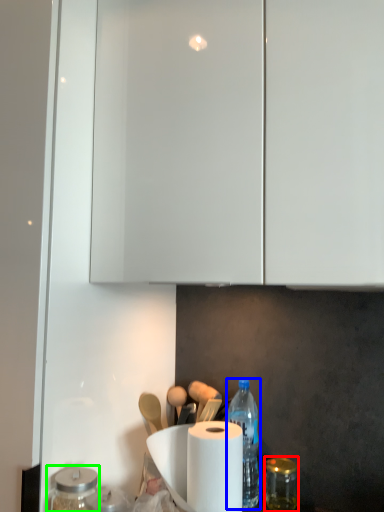
Question: Based on their relative distances, which object is nearer to glass jar (highlighted by a red box)? Choose from bottle (highlighted by a blue box) and glass jar (highlighted by a green box).

Choices:
 (A) bottle
 (B) glass jar

Answer: (A)